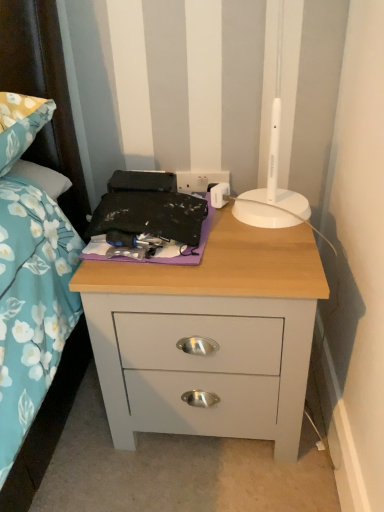
Question: Is purple fabric at center taller than matte gray nightstand at center?

Choices:
 (A) no
 (B) yes

Answer: (A)

Question: Would you say purple fabric at center is a long distance from matte gray nightstand at center?

Choices:
 (A) yes
 (B) no

Answer: (B)

Question: Is purple fabric at center oriented away from matte gray nightstand at center?

Choices:
 (A) yes
 (B) no

Answer: (B)

Question: Is purple fabric at center surrounding matte gray nightstand at center?

Choices:
 (A) yes
 (B) no

Answer: (B)

Question: Does purple fabric at center have a larger size compared to matte gray nightstand at center?

Choices:
 (A) no
 (B) yes

Answer: (A)

Question: From a real-world perspective, is purple fabric at center positioned above or below matte gray nightstand at center?

Choices:
 (A) above
 (B) below

Answer: (A)

Question: Does point (192, 262) appear closer or farther from the camera than point (233, 222)?

Choices:
 (A) farther
 (B) closer

Answer: (B)

Question: In terms of size, does purple fabric at center appear bigger or smaller than matte gray nightstand at center?

Choices:
 (A) big
 (B) small

Answer: (B)

Question: Is purple fabric at center spatially inside matte gray nightstand at center, or outside of it?

Choices:
 (A) inside
 (B) outside

Answer: (A)

Question: Is purple fabric at center to the left or to the right of white plastic electric outlet at upper center in the image?

Choices:
 (A) right
 (B) left

Answer: (B)

Question: Is purple fabric at center taller or shorter than white plastic electric outlet at upper center?

Choices:
 (A) tall
 (B) short

Answer: (A)

Question: From the image's perspective, relative to white plastic electric outlet at upper center, is purple fabric at center above or below?

Choices:
 (A) above
 (B) below

Answer: (B)

Question: From a real-world perspective, is purple fabric at center physically located above or below white plastic electric outlet at upper center?

Choices:
 (A) below
 (B) above

Answer: (B)

Question: Based on their positions, is white plastic electric outlet at upper center located to the left or right of matte gray nightstand at center?

Choices:
 (A) left
 (B) right

Answer: (A)

Question: Is white plastic electric outlet at upper center in front of or behind matte gray nightstand at center in the image?

Choices:
 (A) front
 (B) behind

Answer: (B)